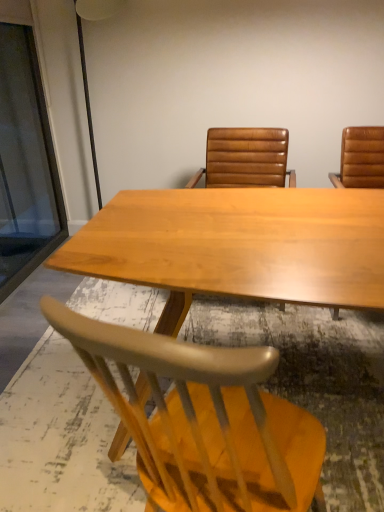
Question: Is light wood chair at lower center, the first chair from the bottom, far from leather at center, acting as the 1th chair starting from the top?

Choices:
 (A) yes
 (B) no

Answer: (A)

Question: From a real-world perspective, is light wood chair at lower center, positioned as the 2th chair in top-to-bottom order, beneath leather at center, acting as the 1th chair starting from the top?

Choices:
 (A) no
 (B) yes

Answer: (B)

Question: From the image's perspective, is light wood chair at lower center, positioned as the 2th chair in top-to-bottom order, above leather at center, the 2th chair from the bottom?

Choices:
 (A) yes
 (B) no

Answer: (B)

Question: Considering the relative sizes of light wood chair at lower center, positioned as the 2th chair in top-to-bottom order, and leather at center, acting as the 1th chair starting from the top, in the image provided, is light wood chair at lower center, positioned as the 2th chair in top-to-bottom order, shorter than leather at center, acting as the 1th chair starting from the top,?

Choices:
 (A) yes
 (B) no

Answer: (A)

Question: Could you tell me if light wood chair at lower center, positioned as the 2th chair in top-to-bottom order, is facing leather at center, the 2th chair from the bottom?

Choices:
 (A) no
 (B) yes

Answer: (A)

Question: From their relative heights in the image, would you say transparent glass door at left is taller or shorter than light wood chair at lower center, the first chair from the bottom?

Choices:
 (A) short
 (B) tall

Answer: (B)

Question: From the image's perspective, relative to light wood chair at lower center, positioned as the 2th chair in top-to-bottom order, is transparent glass door at left above or below?

Choices:
 (A) above
 (B) below

Answer: (A)

Question: Is transparent glass door at left wider or thinner than light wood chair at lower center, positioned as the 2th chair in top-to-bottom order?

Choices:
 (A) wide
 (B) thin

Answer: (B)

Question: Is transparent glass door at left situated inside light wood chair at lower center, positioned as the 2th chair in top-to-bottom order, or outside?

Choices:
 (A) inside
 (B) outside

Answer: (B)

Question: In the image, is leather at center, acting as the 1th chair starting from the top, positioned in front of or behind transparent glass door at left?

Choices:
 (A) behind
 (B) front

Answer: (A)

Question: Looking at their shapes, would you say leather at center, acting as the 1th chair starting from the top, is wider or thinner than transparent glass door at left?

Choices:
 (A) wide
 (B) thin

Answer: (A)

Question: Does point (205, 174) appear closer or farther from the camera than point (28, 141)?

Choices:
 (A) farther
 (B) closer

Answer: (B)

Question: Is leather at center, acting as the 1th chair starting from the top, taller or shorter than transparent glass door at left?

Choices:
 (A) tall
 (B) short

Answer: (B)

Question: Is point (163, 366) positioned closer to the camera than point (205, 218)?

Choices:
 (A) farther
 (B) closer

Answer: (B)

Question: Considering the relative positions of light wood chair at lower center, positioned as the 2th chair in top-to-bottom order, and light brown wood table at center in the image provided, is light wood chair at lower center, positioned as the 2th chair in top-to-bottom order, to the left or to the right of light brown wood table at center?

Choices:
 (A) left
 (B) right

Answer: (A)